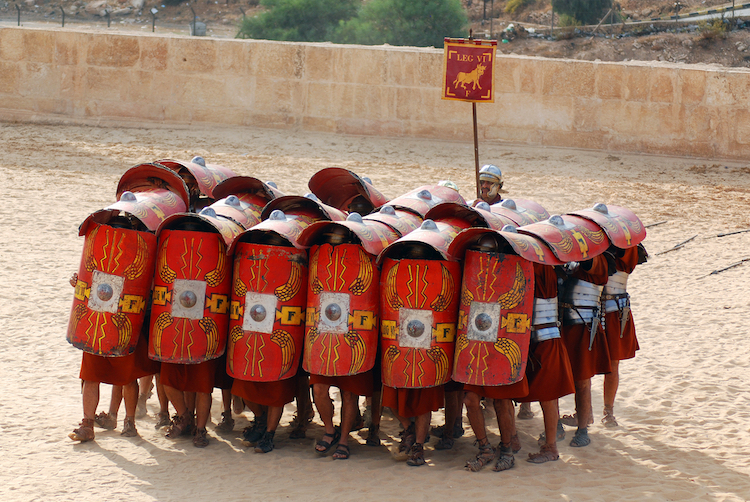
Where is `wall`? Image resolution: width=750 pixels, height=502 pixels. wall is located at coordinates pos(316,82).